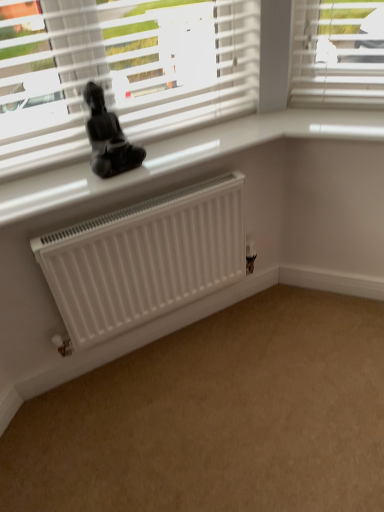
Find the location of `free space to the right of black glossy statue at upper center`. free space to the right of black glossy statue at upper center is located at coordinates (162, 153).